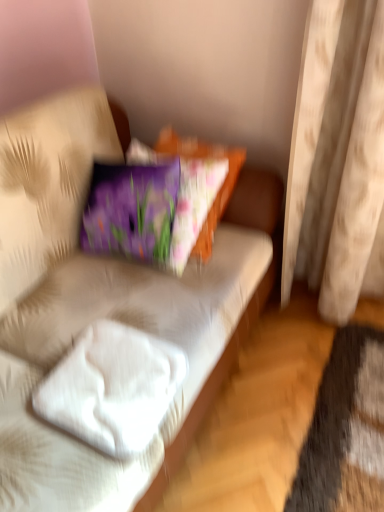
Question: Considering their positions, is white soft pillow at lower left located in front of or behind white fabric couch at center?

Choices:
 (A) front
 (B) behind

Answer: (A)

Question: Would you say white soft pillow at lower left is inside or outside white fabric couch at center?

Choices:
 (A) inside
 (B) outside

Answer: (B)

Question: Which of these objects is positioned closest to the white soft pillow at lower left?

Choices:
 (A) beige fabric curtain at right
 (B) white fabric couch at center

Answer: (B)

Question: Estimate the real-world distances between objects in this image. Which object is closer to the white fabric couch at center?

Choices:
 (A) white soft pillow at lower left
 (B) beige fabric curtain at right

Answer: (A)